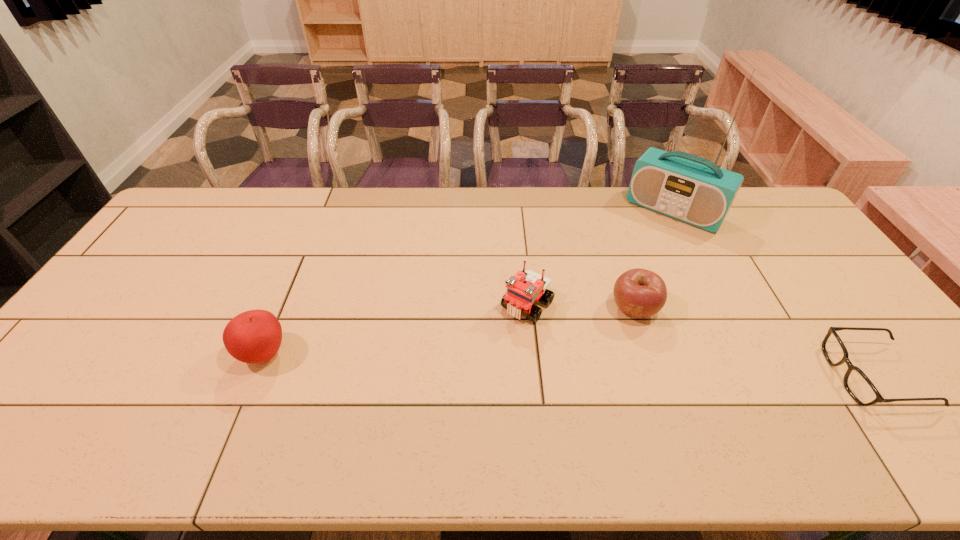
Where is `vacant space that is in between the tallest object and the second object from left to right`? The height and width of the screenshot is (540, 960). vacant space that is in between the tallest object and the second object from left to right is located at coordinates (601, 258).

Find the location of a particular element. This screenshot has height=540, width=960. empty space between the farthest object and the shortest object is located at coordinates tap(774, 293).

This screenshot has width=960, height=540. Find the location of `object that is the closest one to the farthest object`. object that is the closest one to the farthest object is located at coordinates (639, 293).

This screenshot has width=960, height=540. In order to click on object that stands as the closest to the radio receiver in this screenshot , I will do `click(639, 293)`.

You are a GUI agent. You are given a task and a screenshot of the screen. Output one action in this format:
    pyautogui.click(x=<x>, y=<y>)
    Task: Click on the vacant point that satisfies the following two spatial constraints: 1. on the back side of the farthest object; 2. on the right side of the fourth object from right to left
    The width and height of the screenshot is (960, 540).
    Given the screenshot: What is the action you would take?
    pyautogui.click(x=517, y=211)

The image size is (960, 540). I want to click on free space that satisfies the following two spatial constraints: 1. on the back side of the taller apple; 2. on the left side of the second object from right to left, so click(x=324, y=211).